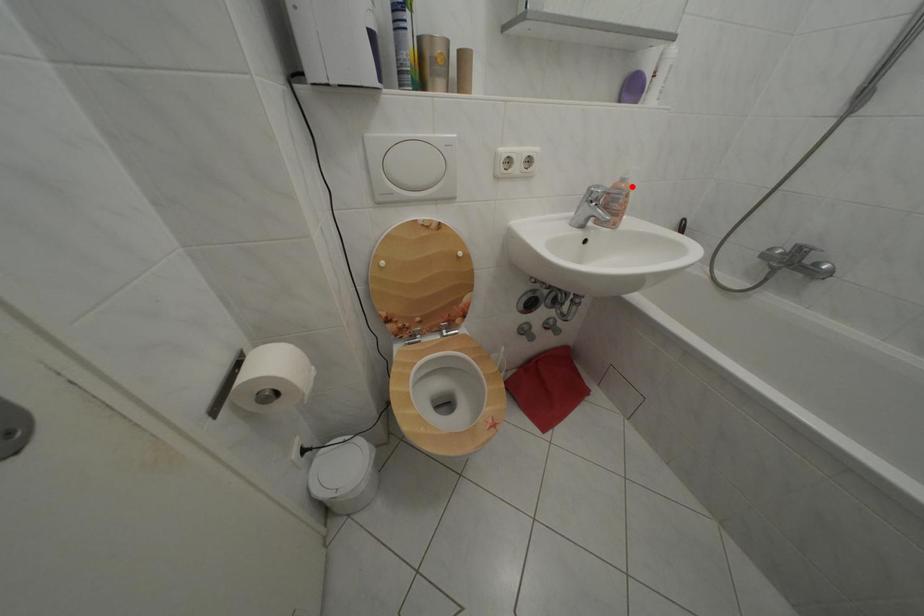
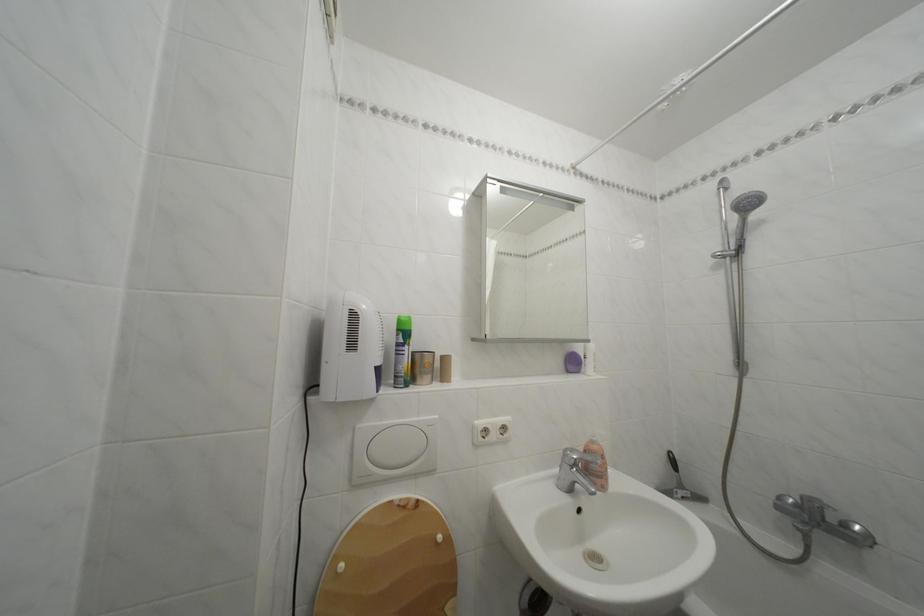
Locate, in the second image, the point that corresponds to the highlighted location in the first image.

(602, 448)